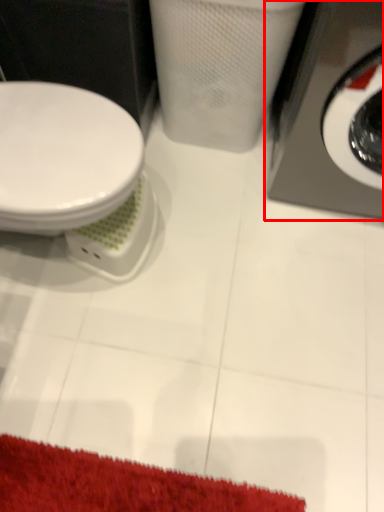
Question: Where is washing machine (annotated by the red box) located in relation to toilet in the image?

Choices:
 (A) right
 (B) left

Answer: (A)